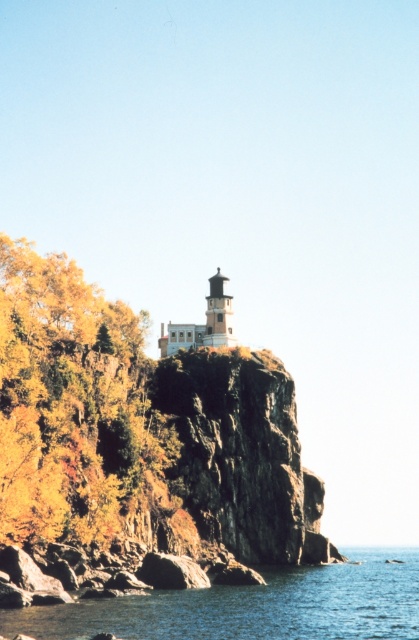
Question: Which point appears farthest from the camera in this image?

Choices:
 (A) (118, 420)
 (B) (413, 632)

Answer: (A)

Question: Can you confirm if yellow-green foliage at left is positioned above blue water at lower center?

Choices:
 (A) yes
 (B) no

Answer: (A)

Question: Which point is closer to the camera taking this photo?

Choices:
 (A) (147, 442)
 (B) (56, 630)

Answer: (B)

Question: Can you confirm if yellow-green foliage at left is positioned above blue water at lower center?

Choices:
 (A) no
 (B) yes

Answer: (B)

Question: Among these points, which one is nearest to the camera?

Choices:
 (A) (64, 269)
 (B) (416, 600)

Answer: (B)

Question: Can you confirm if yellow-green foliage at left is wider than blue water at lower center?

Choices:
 (A) no
 (B) yes

Answer: (A)